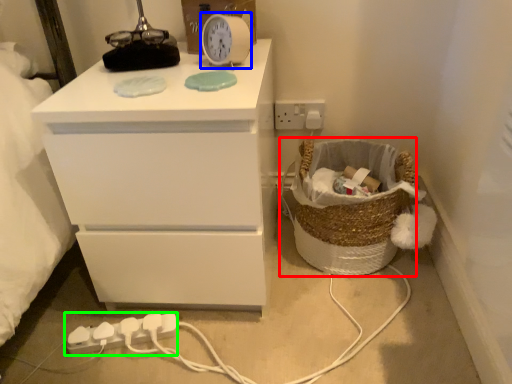
Question: Which is farther away from basket (highlighted by a red box)? clock (highlighted by a blue box) or extension cord (highlighted by a green box)?

Choices:
 (A) clock
 (B) extension cord

Answer: (B)